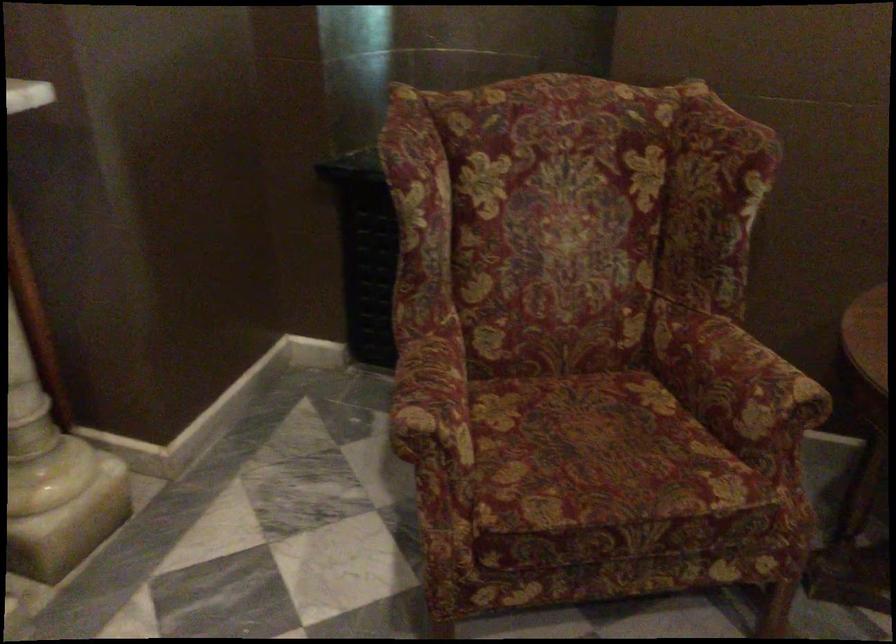
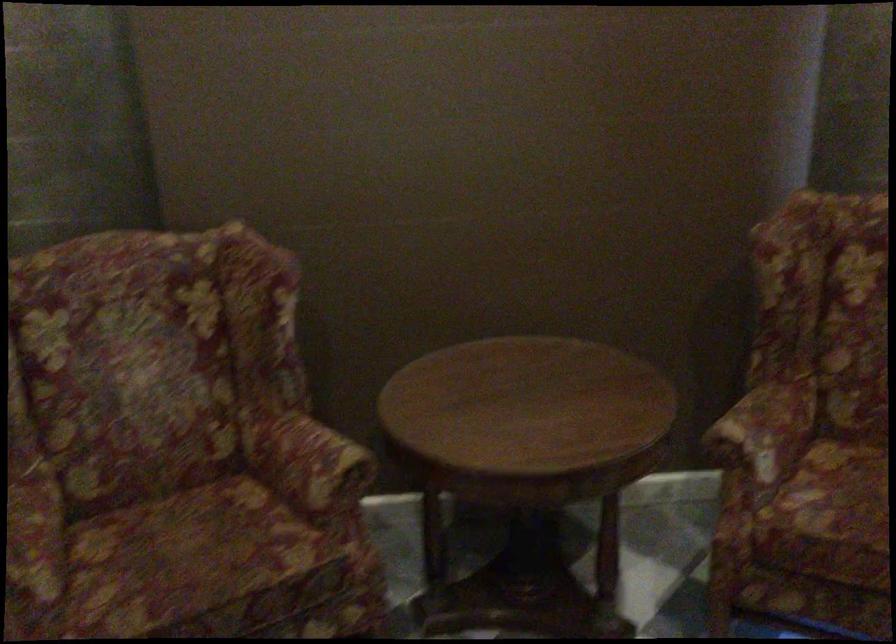
Question: How did the camera likely rotate?

Choices:
 (A) Left
 (B) Right
 (C) Up
 (D) Down

Answer: (B)